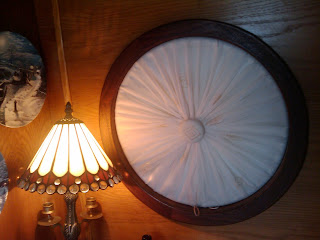
Locate an element on the screen. The width and height of the screenshot is (320, 240). wood wall is located at coordinates (104, 38), (19, 201).